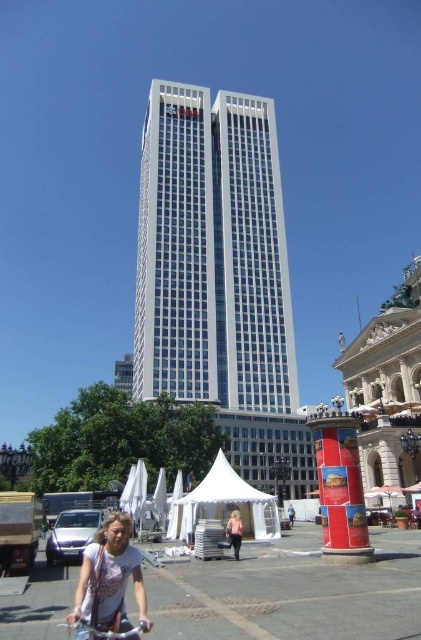
Which is above, white t-shirt at lower center or pink fabric umbrella at lower center?

white t-shirt at lower center

Looking at this image, can you confirm if white t-shirt at lower center is wider than pink fabric umbrella at lower center?

Yes.

Between point (109, 628) and point (237, 522), which one is positioned behind?

The point (237, 522) is more distant.

At what (x,y) coordinates should I click in order to perform the action: click on white t-shirt at lower center. Please return your answer as a coordinate pair (x, y). Looking at the image, I should click on pyautogui.click(x=109, y=579).

Can you confirm if white t-shirt at lower center is smaller than silver metallic bicycle at lower center?

No, white t-shirt at lower center is not smaller than silver metallic bicycle at lower center.

Identify the location of white t-shirt at lower center. The image size is (421, 640). pyautogui.click(x=109, y=579).

Locate an element on the screen. This screenshot has width=421, height=640. white t-shirt at lower center is located at coordinates (109, 579).

Does silver metallic bicycle at lower center come in front of pink fabric umbrella at lower center?

Yes, it is in front of pink fabric umbrella at lower center.

Is silver metallic bicycle at lower center shorter than pink fabric umbrella at lower center?

No.

Which is in front, point (109, 636) or point (242, 529)?

Point (109, 636) is more forward.

You are a GUI agent. You are given a task and a screenshot of the screen. Output one action in this format:
    pyautogui.click(x=<x>, y=<y>)
    Task: Click on the silver metallic bicycle at lower center
    The image size is (421, 640).
    Given the screenshot: What is the action you would take?
    pyautogui.click(x=108, y=628)